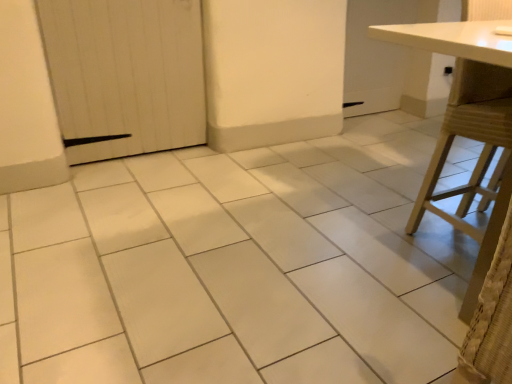
Question: Considering the positions of white wood door at left and white matte table at right in the image, is white wood door at left bigger or smaller than white matte table at right?

Choices:
 (A) big
 (B) small

Answer: (B)

Question: Is white wood door at left in front of or behind white matte table at right in the image?

Choices:
 (A) front
 (B) behind

Answer: (B)

Question: Would you say white wood door at left is to the left or to the right of white matte table at right in the picture?

Choices:
 (A) right
 (B) left

Answer: (B)

Question: Visually, is white matte table at right positioned to the left or to the right of white wood door at left?

Choices:
 (A) right
 (B) left

Answer: (A)

Question: From their relative heights in the image, would you say white matte table at right is taller or shorter than white wood door at left?

Choices:
 (A) short
 (B) tall

Answer: (B)

Question: Considering their positions, is white matte table at right located in front of or behind white wood door at left?

Choices:
 (A) front
 (B) behind

Answer: (A)

Question: From the image's perspective, is white matte table at right above or below white wood door at left?

Choices:
 (A) below
 (B) above

Answer: (A)